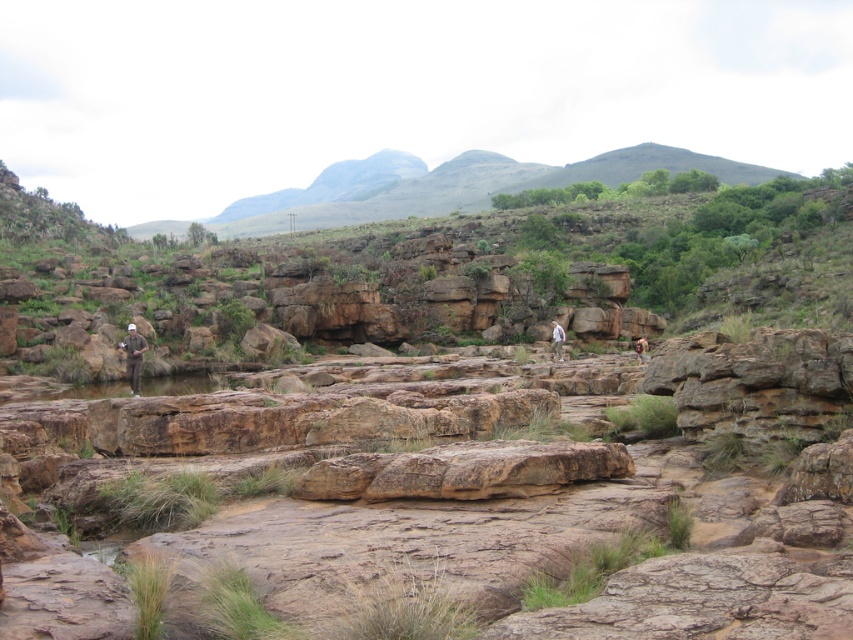
Question: Observing the image, what is the correct spatial positioning of green grassy hill at upper center in reference to white cotton shirt at center?

Choices:
 (A) above
 (B) below

Answer: (A)

Question: Among these objects, which one is farthest from the camera?

Choices:
 (A) camouflage fabric hat at left
 (B) brown leather backpack at center-right
 (C) green grassy hill at upper center

Answer: (C)

Question: Which object is the farthest from the brown leather backpack at center-right?

Choices:
 (A) camouflage fabric hat at left
 (B) green grassy hill at upper center

Answer: (B)

Question: Is camouflage fabric hat at left further to the viewer compared to white cotton shirt at center?

Choices:
 (A) no
 (B) yes

Answer: (A)

Question: Which point is farther from the camera taking this photo?

Choices:
 (A) (642, 346)
 (B) (550, 349)

Answer: (B)

Question: Can you confirm if camouflage fabric hat at left is smaller than white cotton shirt at center?

Choices:
 (A) no
 (B) yes

Answer: (A)